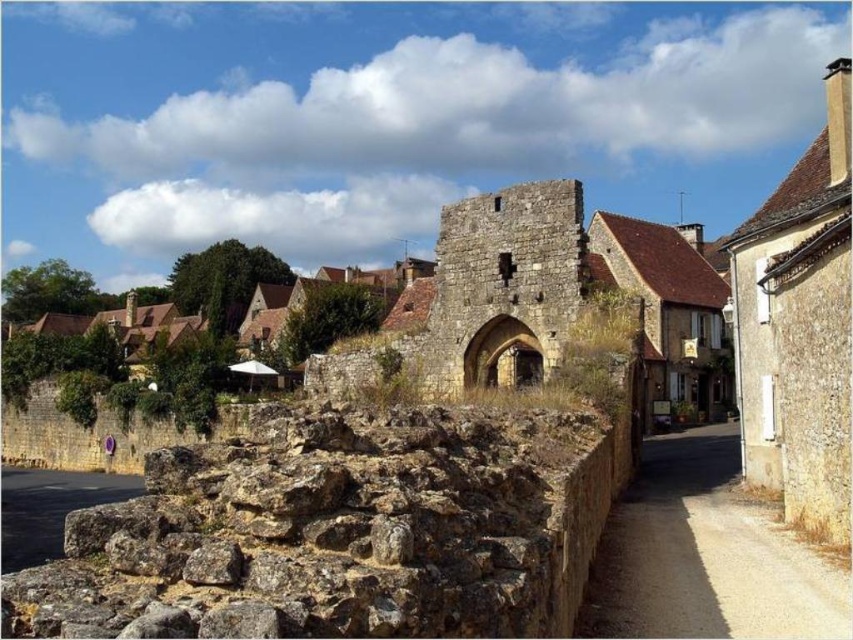
You are a tourist standing in the historic village and want to take a photo of the brown rough stone wall at lower left and the dark gray stone alley at lower left. Which object should you focus on first if you want to capture both in the same frame without moving your camera?

You should focus on the brown rough stone wall at lower left first because it is taller than the dark gray stone alley at lower left, so adjusting the camera angle to include its height will naturally include the alley below it.